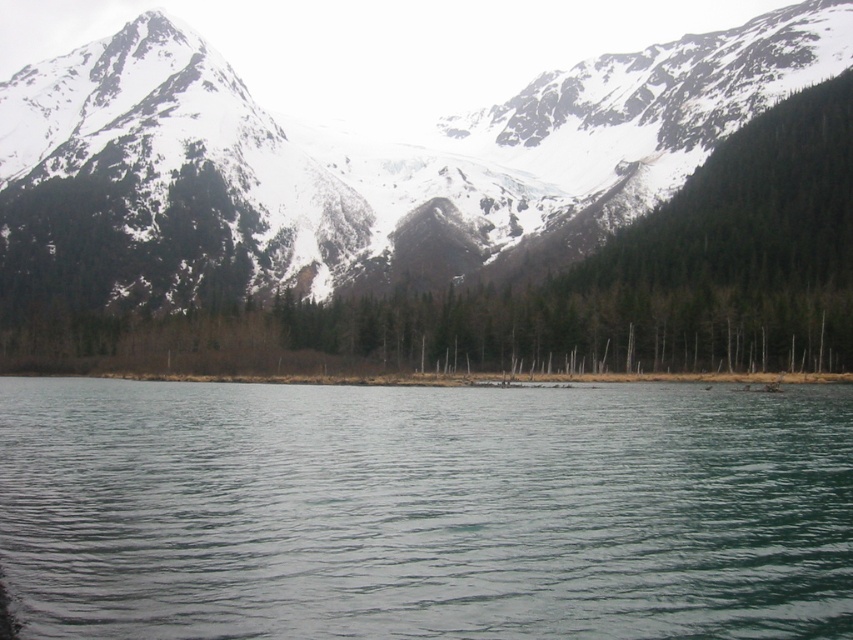
You are a photographer planning to capture the clear water at center and the snowy granite mountain range at upper center in a single frame. Which of the two objects will appear narrower in your photo?

The clear water at center will appear narrower in the photo because it is thinner than the snowy granite mountain range at upper center.

You are standing at the lakeside and want to take a photo that includes both the clear water at center and the snowy granite mountain range at upper center. Which object should you position closer to the bottom of your camera frame?

You should position the clear water at center closer to the bottom of your camera frame because it is not as tall as the snowy granite mountain range at upper center, meaning it occupies a lower vertical position in the scene.